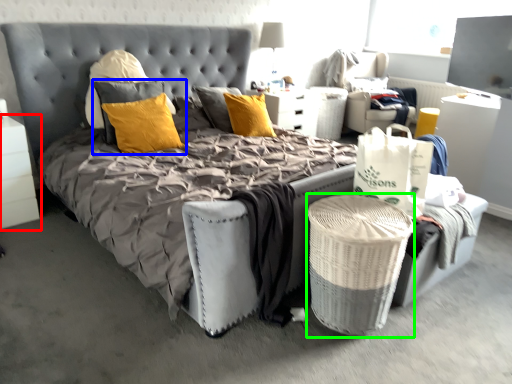
Question: Estimate the real-world distances between objects in this image. Which object is farther from nightstand (highlighted by a red box), pillow (highlighted by a blue box) or laundry basket (highlighted by a green box)?

Choices:
 (A) pillow
 (B) laundry basket

Answer: (B)